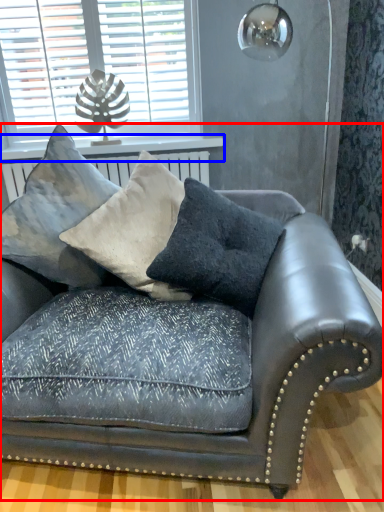
Question: Which object appears closest to the camera in this image, studio couch (highlighted by a red box) or window sill (highlighted by a blue box)?

Choices:
 (A) studio couch
 (B) window sill

Answer: (A)